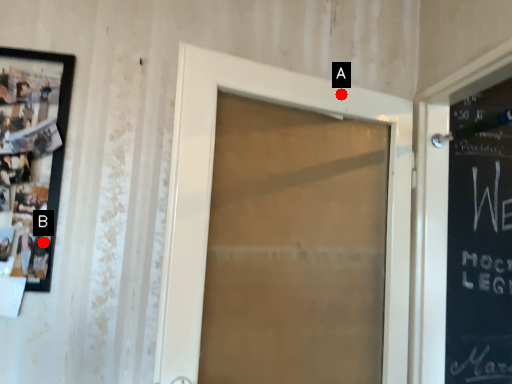
Question: Two points are circled on the image, labeled by A and B beside each circle. Which point is farther to the camera?

Choices:
 (A) A is further
 (B) B is further

Answer: (A)